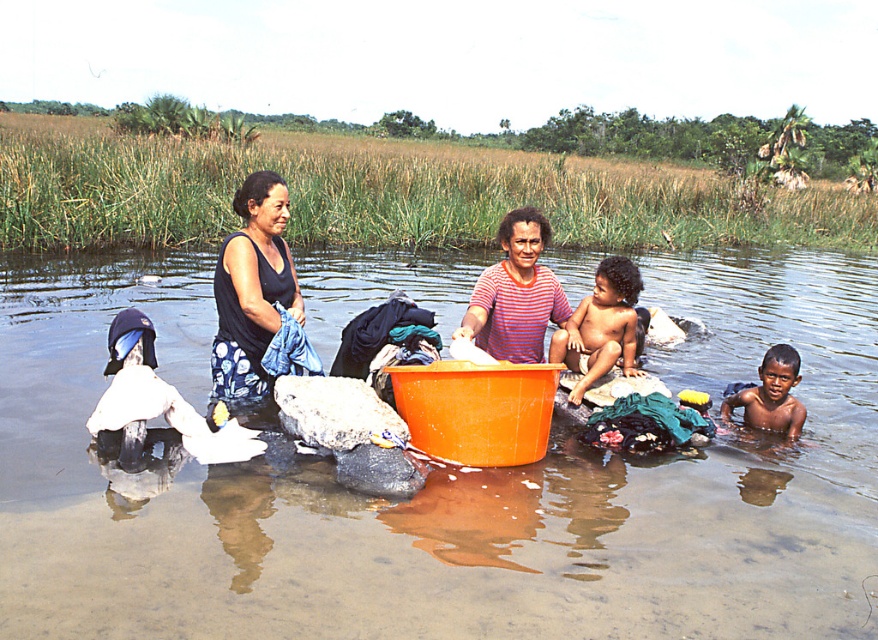
From the picture: You are a photographer trying to capture the reflection of the clear water at center and the black fabric at center in this scene. Which object is more likely to show a clear reflection?

The clear water at center is positioned over black fabric at center, so the clear water at center will have a clearer reflection because it is on top and not obstructed by the fabric below.